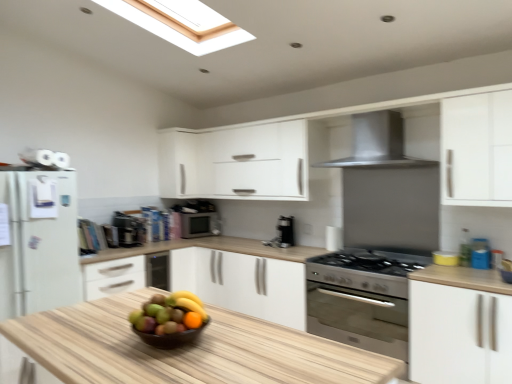
Question: In the image, is metallic silver microwave at center, the 1th appliance from the back, on the left side or the right side of white matte cabinet at right, which is the first cabinetry from front to back?

Choices:
 (A) left
 (B) right

Answer: (A)

Question: Considering the positions of metallic silver microwave at center, arranged as the 2th appliance when viewed from the front, and white matte cabinet at right, which is counted as the 2th cabinetry, starting from the left, in the image, is metallic silver microwave at center, arranged as the 2th appliance when viewed from the front, wider or thinner than white matte cabinet at right, which is counted as the 2th cabinetry, starting from the left,?

Choices:
 (A) wide
 (B) thin

Answer: (B)

Question: Which object is the closest to the stainless steel range hood at upper center?

Choices:
 (A) metallic silver microwave at center, the 1th appliance from the back
 (B) white matte cabinet at right, the first cabinetry viewed from the right
 (C) satin black coffee maker at center, positioned as the 2th appliance in back-to-front order
 (D) shiny brown bowl at center
 (E) white matte cabinet at upper center, the first cabinetry positioned from the back

Answer: (B)

Question: Based on their relative distances, which object is farther from the shiny brown bowl at center?

Choices:
 (A) white matte cabinet at right, which is the 1th cabinetry in bottom-to-top order
 (B) stainless steel range hood at upper center
 (C) metallic silver microwave at center, arranged as the 1th appliance when viewed from the right
 (D) satin black coffee maker at center, the second appliance from the right
 (E) white matte cabinet at upper center, which appears as the first cabinetry when viewed from the top

Answer: (C)